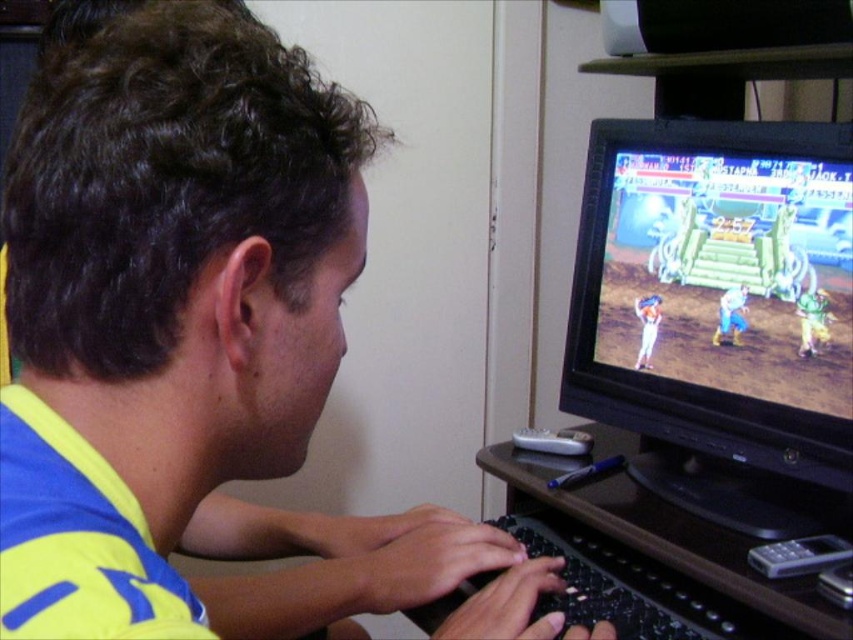
You are setting up a new desk setup and need to place both the black glossy monitor at right and the black plastic keyboard at lower center. Given their sizes, where should you position the larger item to ensure it doesn

The black glossy monitor at right is bigger than the black plastic keyboard at lower center, so you should place the black glossy monitor at right in a position where it has enough space to accommodate its larger size.